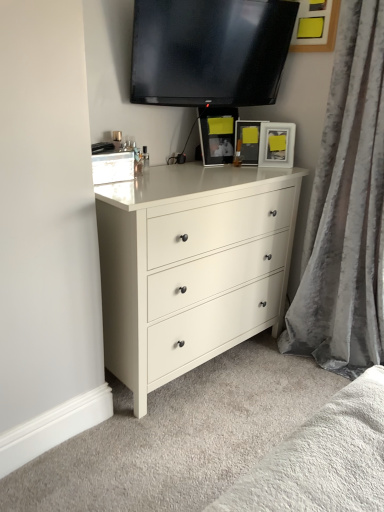
Find the location of `free space in front of matte black picture frame at center, which is the second picture frame from left to right`. free space in front of matte black picture frame at center, which is the second picture frame from left to right is located at coordinates (250, 169).